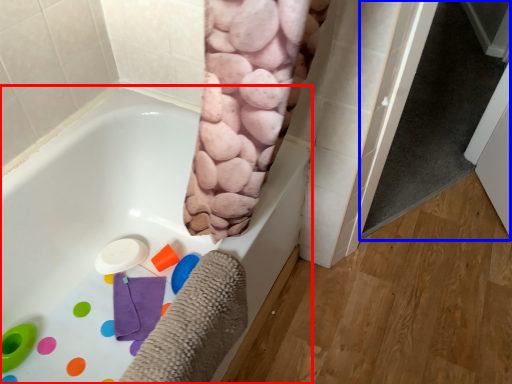
Question: Which of the following is the farthest to the observer, bathtub (highlighted by a red box) or screen door (highlighted by a blue box)?

Choices:
 (A) bathtub
 (B) screen door

Answer: (B)